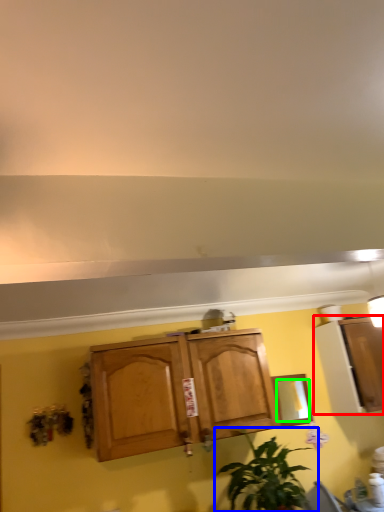
Question: Which object is positioned farthest from cabinetry (highlighted by a red box)? Select from houseplant (highlighted by a blue box) and mirror (highlighted by a green box).

Choices:
 (A) houseplant
 (B) mirror

Answer: (A)